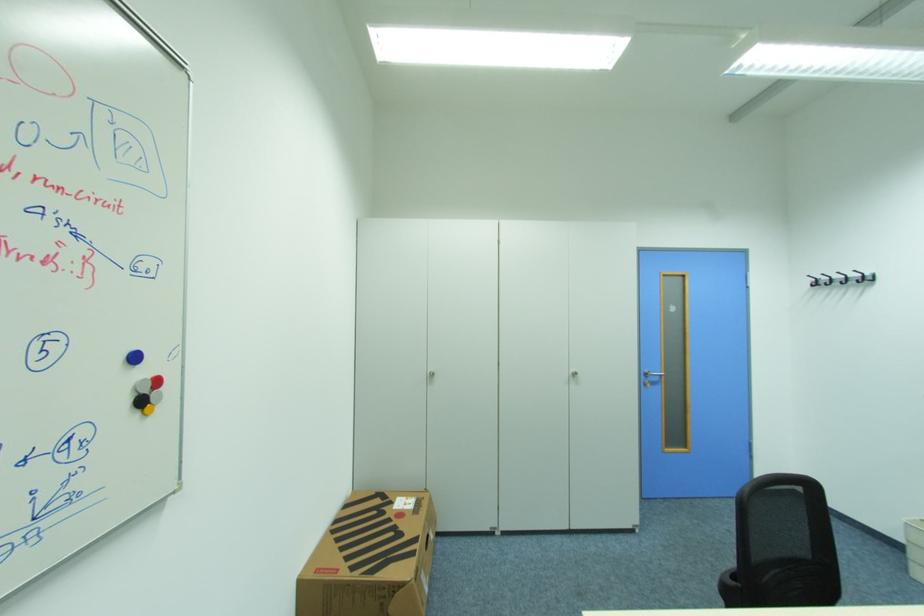
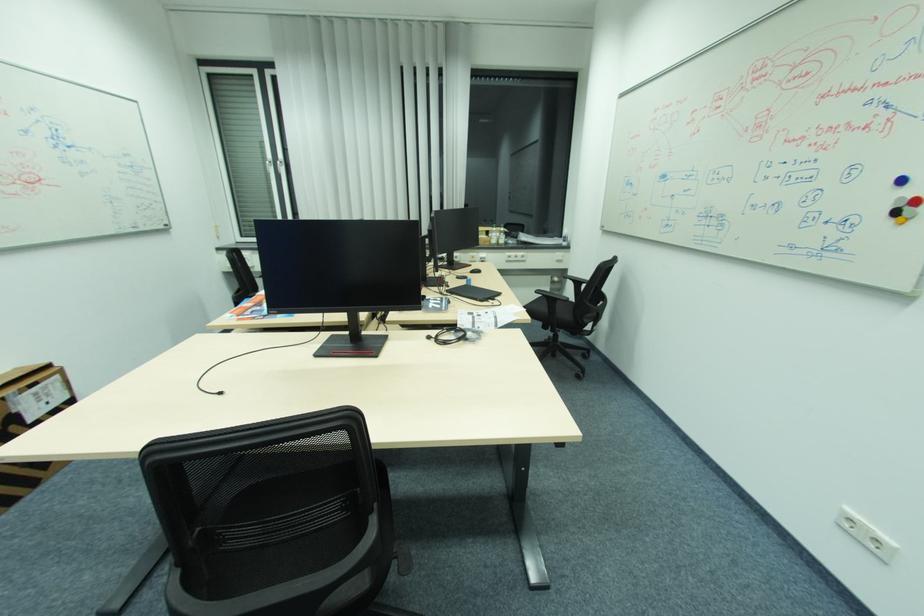
Where in the second image is the point corresponding to (x=141, y=416) from the first image?

(896, 221)